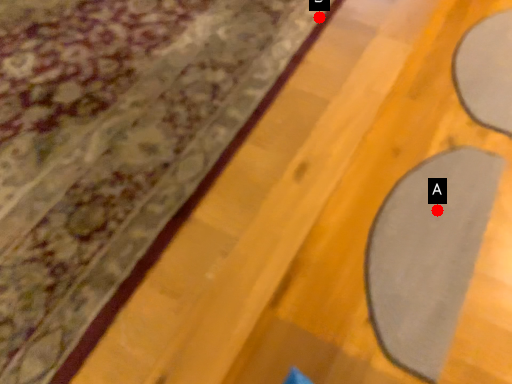
Question: Two points are circled on the image, labeled by A and B beside each circle. Which point is closer to the camera?

Choices:
 (A) A is closer
 (B) B is closer

Answer: (A)